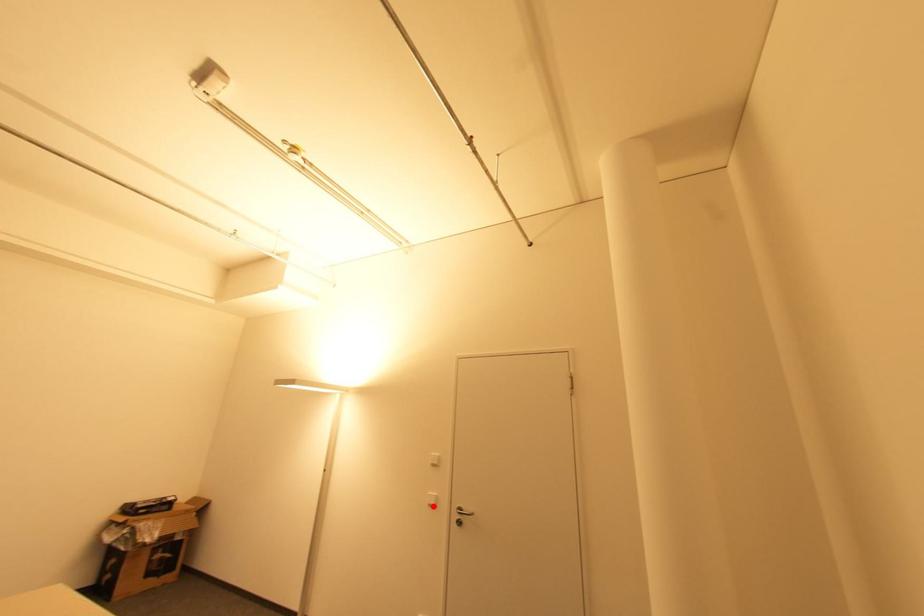
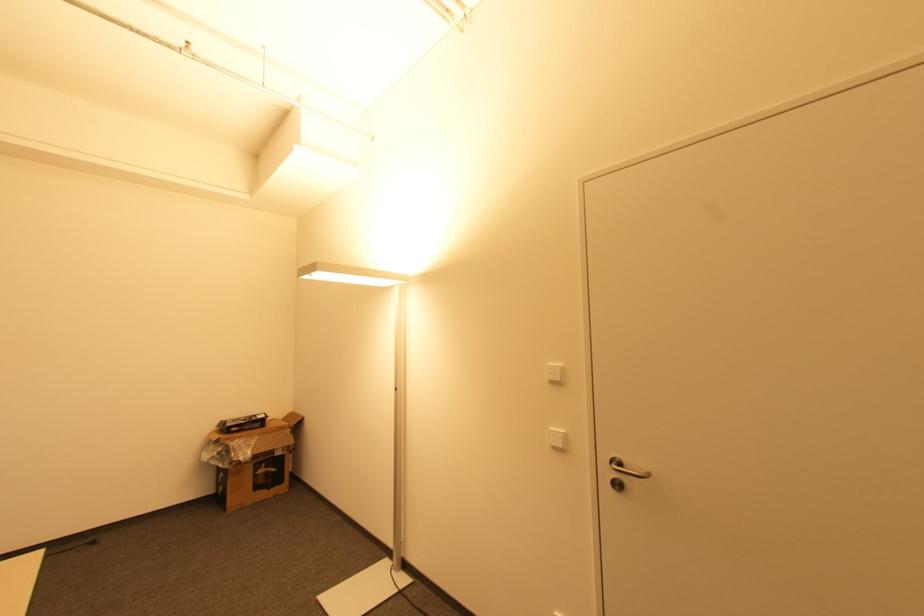
Question: I am providing you with two images of the same scene from different viewpoints. In image1, a red point is highlighted. Considering the same 3D point in image2, which of the following is correct?

Choices:
 (A) It is closer
 (B) It is farther

Answer: (A)